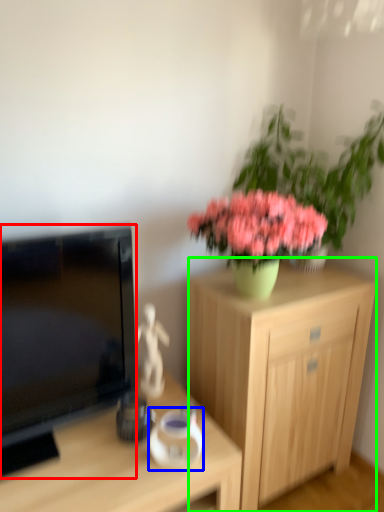
Question: Considering the real-world distances, which object is closest to television (highlighted by a red box)? vase (highlighted by a blue box) or cabinetry (highlighted by a green box).

Choices:
 (A) vase
 (B) cabinetry

Answer: (A)